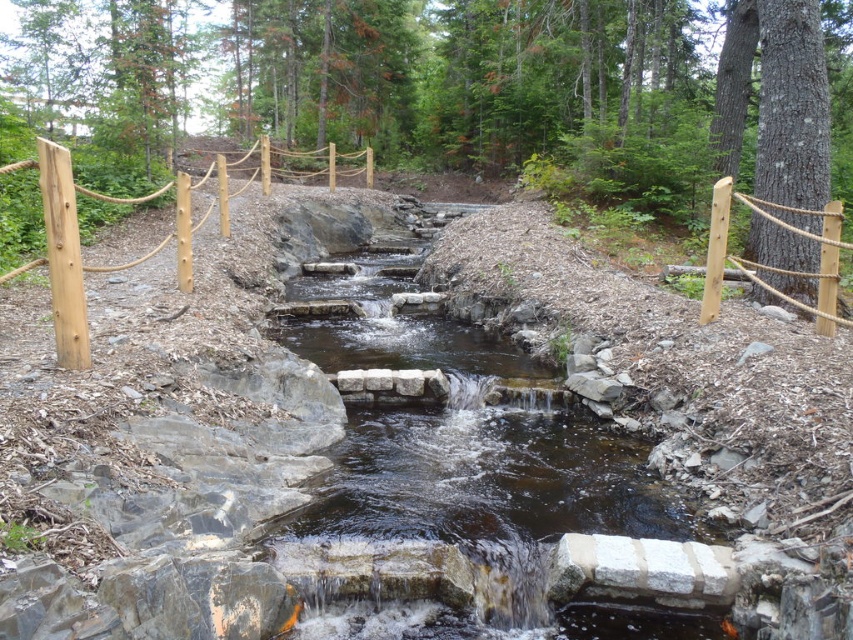
Question: Can you confirm if wooden post at left is smaller than brown wooden post at left?

Choices:
 (A) no
 (B) yes

Answer: (A)

Question: Can you confirm if smooth stone stream at center is positioned below brown wood post at right?

Choices:
 (A) no
 (B) yes

Answer: (B)

Question: Considering the relative positions of smooth stone stream at center and wooden post at left in the image provided, where is smooth stone stream at center located with respect to wooden post at left?

Choices:
 (A) left
 (B) right

Answer: (B)

Question: Estimate the real-world distances between objects in this image. Which object is closer to the brown wooden post at left?

Choices:
 (A) brown wood post at right
 (B) wooden post at left
 (C) smooth stone stream at center

Answer: (C)

Question: Among these points, which one is nearest to the camera?

Choices:
 (A) (56, 184)
 (B) (549, 625)
 (C) (769, 220)

Answer: (B)

Question: Estimate the real-world distances between objects in this image. Which object is closer to the smooth stone stream at center?

Choices:
 (A) wooden post at left
 (B) brown wooden post at left

Answer: (B)